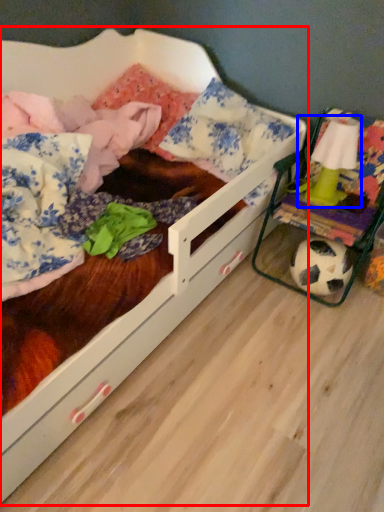
Question: Which object appears farthest to the camera in this image, infant bed (highlighted by a red box) or toy (highlighted by a blue box)?

Choices:
 (A) infant bed
 (B) toy

Answer: (B)